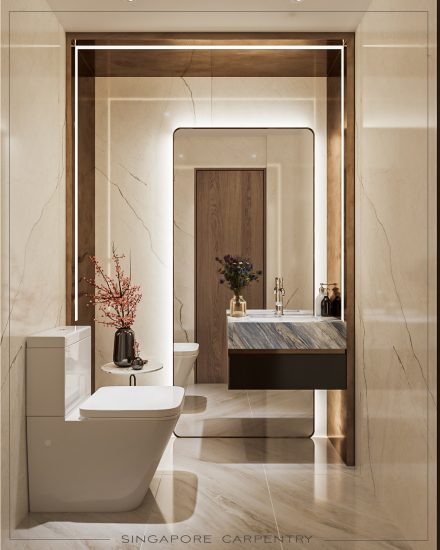
Locate an element on the screen. Image resolution: width=440 pixels, height=550 pixels. marble like ceiling is located at coordinates (190, 20).